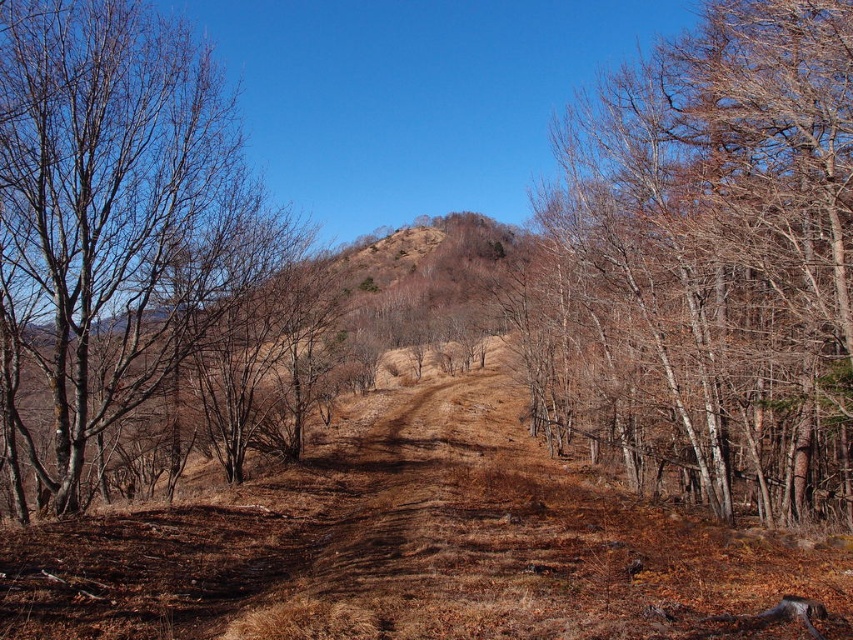
Question: Is brown bark tree at right bigger than bare branches at left?

Choices:
 (A) no
 (B) yes

Answer: (B)

Question: Can you confirm if brown bark tree at right is smaller than bare branches at left?

Choices:
 (A) no
 (B) yes

Answer: (A)

Question: Which point is farther to the camera?

Choices:
 (A) bare branches at left
 (B) brown bark tree at right

Answer: (B)

Question: Which of the following is the farthest from the observer?

Choices:
 (A) bare branches at left
 (B) brown bark tree at right

Answer: (B)

Question: Is the position of brown bark tree at right less distant than that of bare branches at left?

Choices:
 (A) yes
 (B) no

Answer: (B)